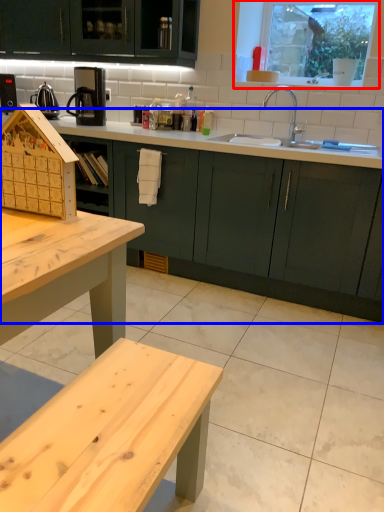
Question: Which point is further to the camera, window (highlighted by a red box) or countertop (highlighted by a blue box)?

Choices:
 (A) window
 (B) countertop

Answer: (A)